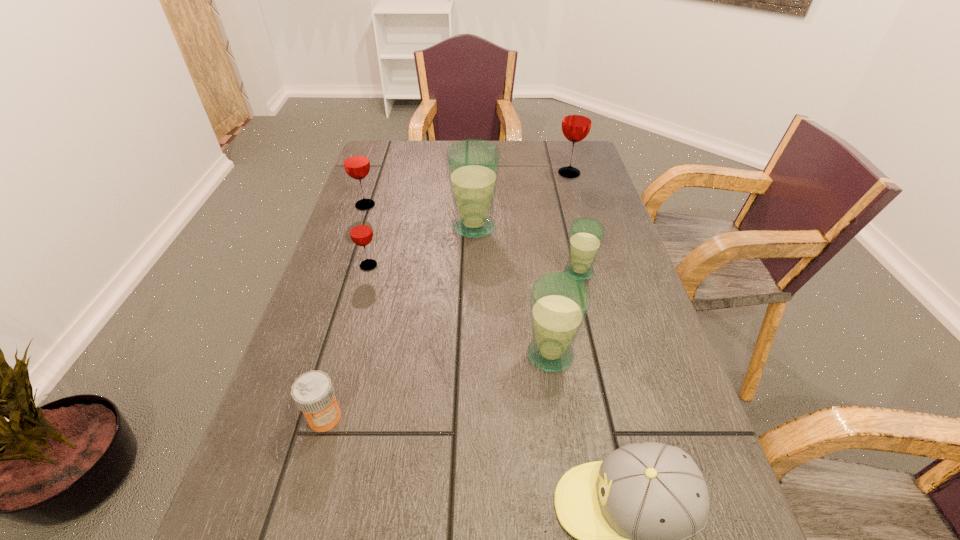
Where is `vacant space that is in between the biggest red glass and the third farthest glass`? The image size is (960, 540). vacant space that is in between the biggest red glass and the third farthest glass is located at coordinates (521, 200).

Identify the location of vacant area between the smallest red glass and the orange medicine. Image resolution: width=960 pixels, height=540 pixels. click(347, 341).

At what (x,y) coordinates should I click in order to perform the action: click on free space between the orange medicine and the third glass from right to left. Please return your answer as a coordinate pair (x, y). The height and width of the screenshot is (540, 960). Looking at the image, I should click on (438, 386).

You are a GUI agent. You are given a task and a screenshot of the screen. Output one action in this format:
    pyautogui.click(x=<x>, y=<y>)
    Task: Click on the object that is the fourth closest to the nearest object
    The width and height of the screenshot is (960, 540).
    Given the screenshot: What is the action you would take?
    pyautogui.click(x=473, y=165)

Locate which object ranks in proximity to the baseball cap. Please provide its 2D coordinates. Your answer should be formatted as a tuple, i.e. [(x, y)], where the tuple contains the x and y coordinates of a point satisfying the conditions above.

[(559, 301)]

Identify which glass is located as the second nearest to the second smallest red glass. Please provide its 2D coordinates. Your answer should be formatted as a tuple, i.e. [(x, y)], where the tuple contains the x and y coordinates of a point satisfying the conditions above.

[(473, 165)]

Locate an element on the screen. The height and width of the screenshot is (540, 960). glass that is the closest to the second nearest blue glass is located at coordinates (559, 301).

At what (x,y) coordinates should I click in order to perform the action: click on the closest red glass to the nearest glass. Please return your answer as a coordinate pair (x, y). Looking at the image, I should click on 360,230.

Find the location of a particular element. Image resolution: width=960 pixels, height=540 pixels. red glass identified as the third closest to the second nearest blue glass is located at coordinates (356, 162).

Image resolution: width=960 pixels, height=540 pixels. Find the location of `blue glass that is the closest one to the fourth nearest glass`. blue glass that is the closest one to the fourth nearest glass is located at coordinates (586, 234).